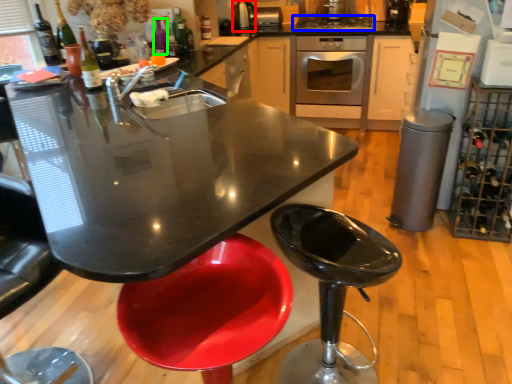
Question: Estimate the real-world distances between objects in this image. Which object is farther from appliance (highlighted by a red box), kitchen appliance (highlighted by a blue box) or bottle (highlighted by a green box)?

Choices:
 (A) kitchen appliance
 (B) bottle

Answer: (B)